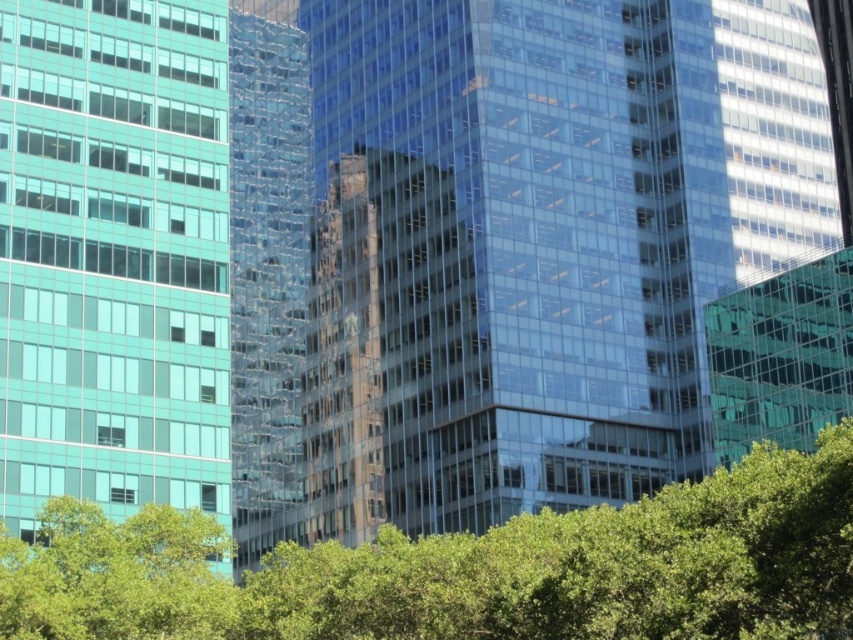
Can you confirm if transparent glass building at center is positioned below green leafy tree at lower center?

Incorrect, transparent glass building at center is not positioned below green leafy tree at lower center.

Is transparent glass building at center further to the viewer compared to green leafy tree at lower center?

That is True.

Does point (722, 198) lie in front of point (28, 602)?

No, (722, 198) is further to viewer.

Find the location of a particular element. transparent glass building at center is located at coordinates (573, 246).

Is teal glass building at left positioned before green leafy tree at lower center?

No, teal glass building at left is further to the viewer.

Who is taller, teal glass building at left or green leafy tree at lower center?

With more height is teal glass building at left.

I want to click on teal glass building at left, so click(113, 256).

Who is lower down, transparent glass building at center or teal glass building at left?

teal glass building at left is lower down.

Does transparent glass building at center have a lesser width compared to teal glass building at left?

No.

Measure the distance between transparent glass building at center and camera.

transparent glass building at center is 250.49 feet away from camera.

Identify the location of transparent glass building at center. (573, 246).